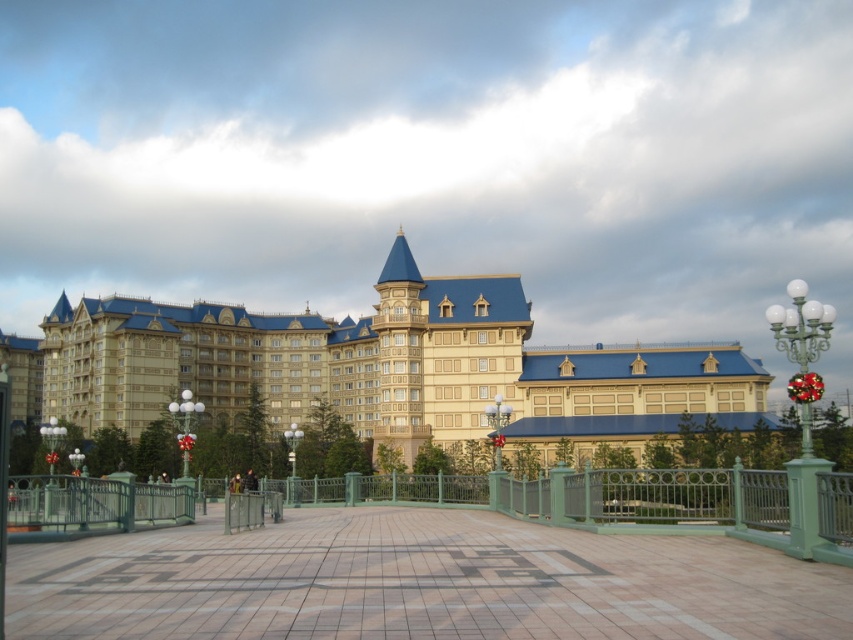
Question: Does pebble stone walkway at center appear on the right side of green metal fence at center?

Choices:
 (A) no
 (B) yes

Answer: (A)

Question: Can you confirm if matte gold palace at center is bigger than green metal fence at center?

Choices:
 (A) yes
 (B) no

Answer: (A)

Question: Among these objects, which one is farthest from the camera?

Choices:
 (A) pebble stone walkway at center
 (B) matte gold palace at center
 (C) green metal fence at center

Answer: (B)

Question: Which point is farther to the camera?

Choices:
 (A) pebble stone walkway at center
 (B) green metal fence at center

Answer: (B)

Question: Among these objects, which one is nearest to the camera?

Choices:
 (A) pebble stone walkway at center
 (B) matte gold palace at center

Answer: (A)

Question: Can you confirm if pebble stone walkway at center is positioned to the right of matte gold palace at center?

Choices:
 (A) no
 (B) yes

Answer: (B)